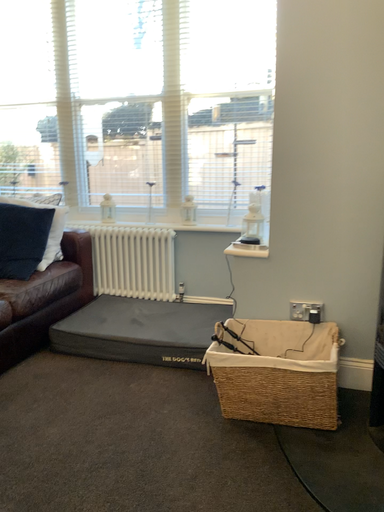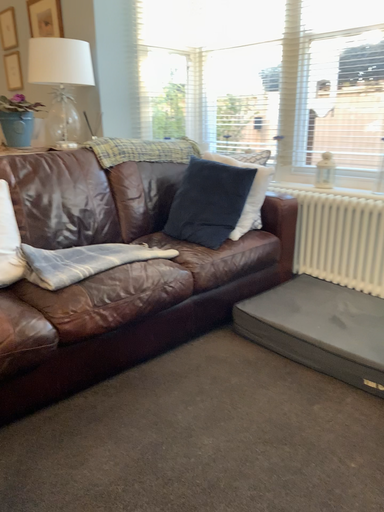
Question: Which way did the camera rotate in the video?

Choices:
 (A) rotated left
 (B) rotated right

Answer: (A)